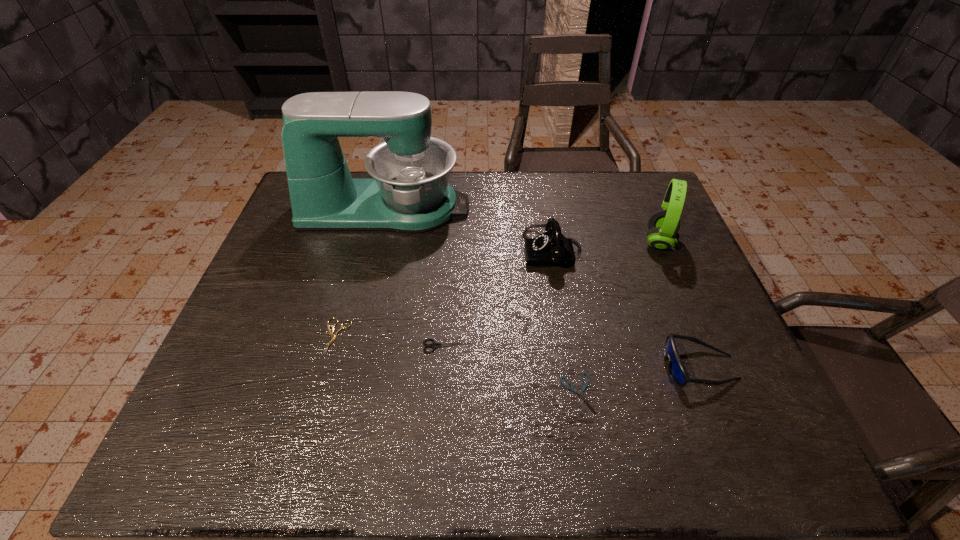
Identify the location of mixer. The image size is (960, 540). (410, 193).

Locate an element on the screen. This screenshot has height=540, width=960. headset is located at coordinates (663, 225).

You are a GUI agent. You are given a task and a screenshot of the screen. Output one action in this format:
    pyautogui.click(x=<x>, y=<y>)
    Task: Click on the third tallest object
    The image size is (960, 540).
    Given the screenshot: What is the action you would take?
    pyautogui.click(x=552, y=248)

Identify the location of sunglasses. (676, 368).

Where is `the second shears from left to right`? the second shears from left to right is located at coordinates (434, 345).

Where is `the tallest shears`? This screenshot has height=540, width=960. the tallest shears is located at coordinates (434, 345).

Identify the location of the leftmost shears. The width and height of the screenshot is (960, 540). (333, 336).

The width and height of the screenshot is (960, 540). In order to click on the second shortest shears in this screenshot , I will do `click(333, 336)`.

This screenshot has width=960, height=540. Identify the location of the shortest shears. (572, 388).

This screenshot has height=540, width=960. I want to click on the shortest object, so click(572, 388).